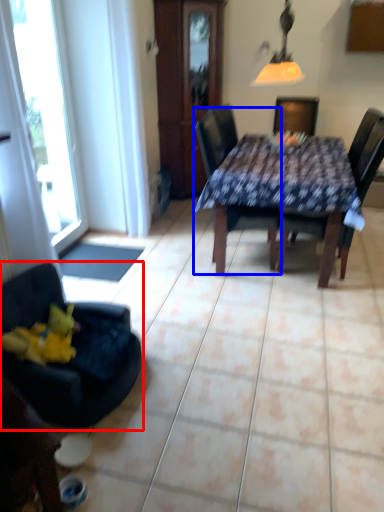
Question: Which object is further to the camera taking this photo, chair (highlighted by a red box) or chair (highlighted by a blue box)?

Choices:
 (A) chair
 (B) chair

Answer: (B)